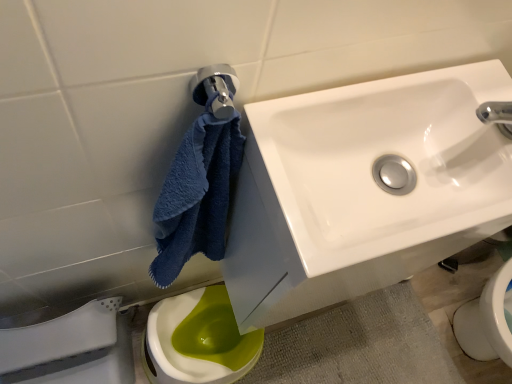
Question: Relative to white glossy sink at upper right, is green glossy toilet at lower left in front or behind?

Choices:
 (A) behind
 (B) front

Answer: (A)

Question: Is point (258, 329) closer or farther from the camera than point (437, 130)?

Choices:
 (A) closer
 (B) farther

Answer: (B)

Question: Which of these objects is positioned closest to the white glossy porcelain at lower left?

Choices:
 (A) green glossy toilet at lower left
 (B) white glossy sink at upper right

Answer: (A)

Question: Which of these objects is positioned closest to the white glossy sink at upper right?

Choices:
 (A) white glossy porcelain at lower left
 (B) green glossy toilet at lower left

Answer: (A)